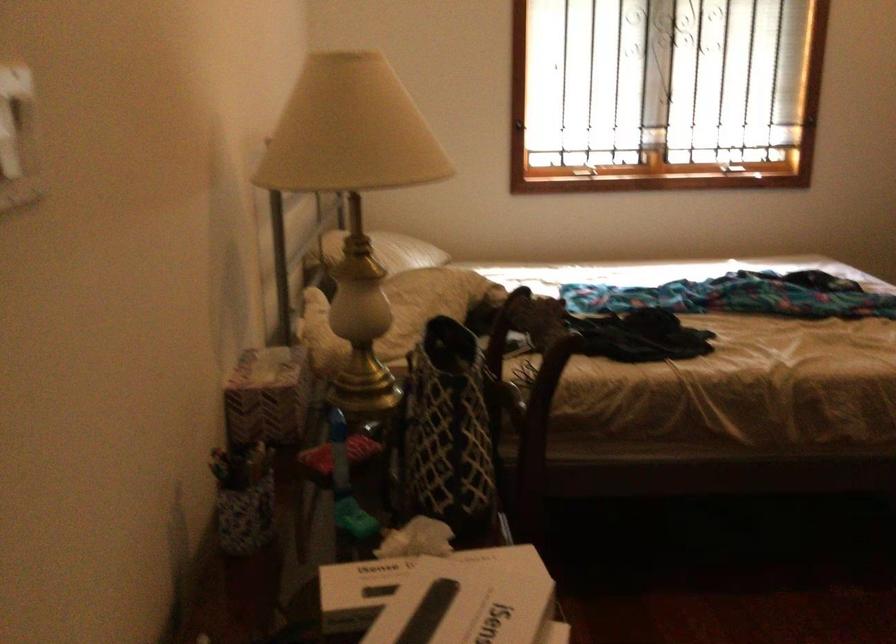
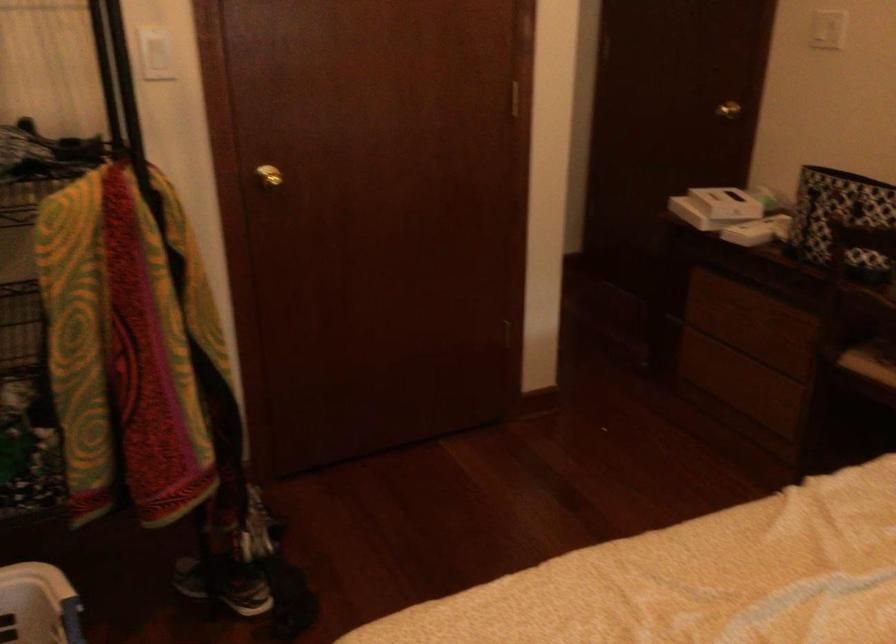
Where in the second image is the point corresponding to [560,334] from the first image?

(840, 218)